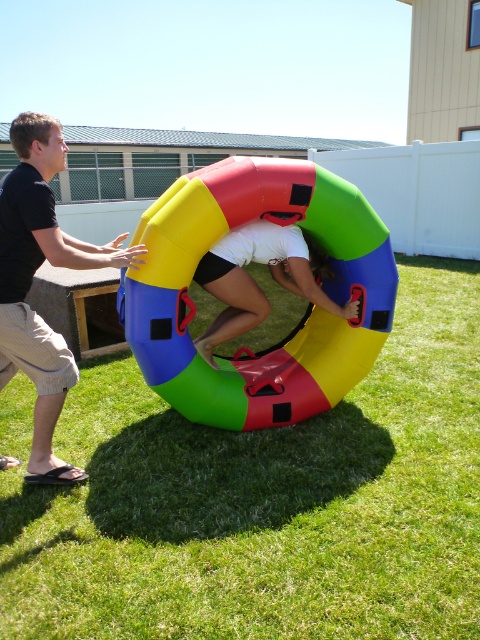
From the picture: You are a photographer trying to capture a candid shot of the black matte shirt at left and the green grass at center. Based on their positions, which object should you focus on first to ensure both are in the frame?

The black matte shirt at left should be focused on first since the green grass at center is positioned on the right side of it, allowing you to adjust the frame to include both from left to right.

You are standing in the outdoor scene and want to move from the point at coordinates point [294,200] to the point at coordinates point [113,241]. Which direction should you move in relation to the inflatable ring?

You should move away from the inflatable ring because point [294,200] is closer to the ring than point [113,241].

You are standing at the position of the man in the scene. You want to throw a small ball to the woman inside the inflatable ring. Which point, point 1 at coordinates point (61, 157) or point 2 at coordinates point (233, 244), is closer to the woman so that the ball lands near her?

Point 1 at coordinates point (61, 157) is closer to the woman inside the inflatable ring because it is closer to the camera than point 2 at coordinates point (233, 244).